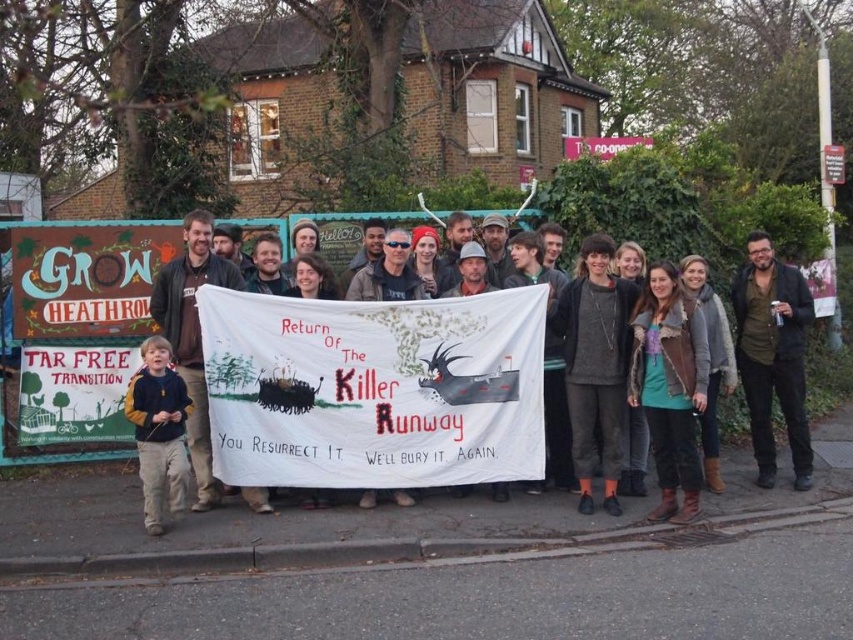
Is white fabric banner at center above dark gray sweater at center?

Answer: No, white fabric banner at center is not above dark gray sweater at center.

From the picture: Who is more distant from viewer, (524, 365) or (587, 330)?

The point (524, 365) is behind.

The width and height of the screenshot is (853, 640). What are the coordinates of `white fabric banner at center` in the screenshot? It's located at (374, 388).

Between dark brown leather jacket at center and black leather jacket at right, which one appears on the left side from the viewer's perspective?

Positioned to the left is dark brown leather jacket at center.

Is dark brown leather jacket at center below black leather jacket at right?

Yes.

The image size is (853, 640). What are the coordinates of `dark brown leather jacket at center` in the screenshot? It's located at (323, 380).

Does black leather jacket at right appear on the right side of velvet yellow sweater at lower left?

Indeed, black leather jacket at right is positioned on the right side of velvet yellow sweater at lower left.

Is black leather jacket at right positioned in front of velvet yellow sweater at lower left?

No, it is not.

Who is more distant from viewer, (747, 296) or (158, 396)?

Point (747, 296)

At what (x,y) coordinates should I click in order to perform the action: click on black leather jacket at right. Please return your answer as a coordinate pair (x, y). Looking at the image, I should click on (772, 355).